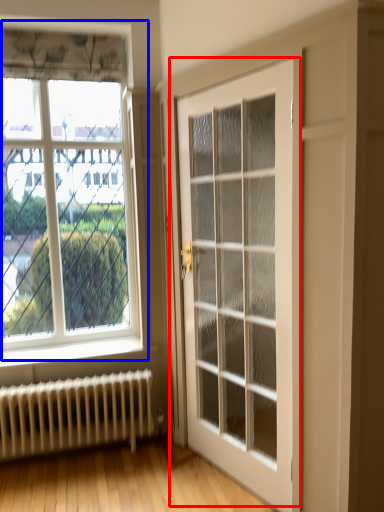
Question: Which object is closer to the camera taking this photo, door (highlighted by a red box) or window (highlighted by a blue box)?

Choices:
 (A) door
 (B) window

Answer: (A)